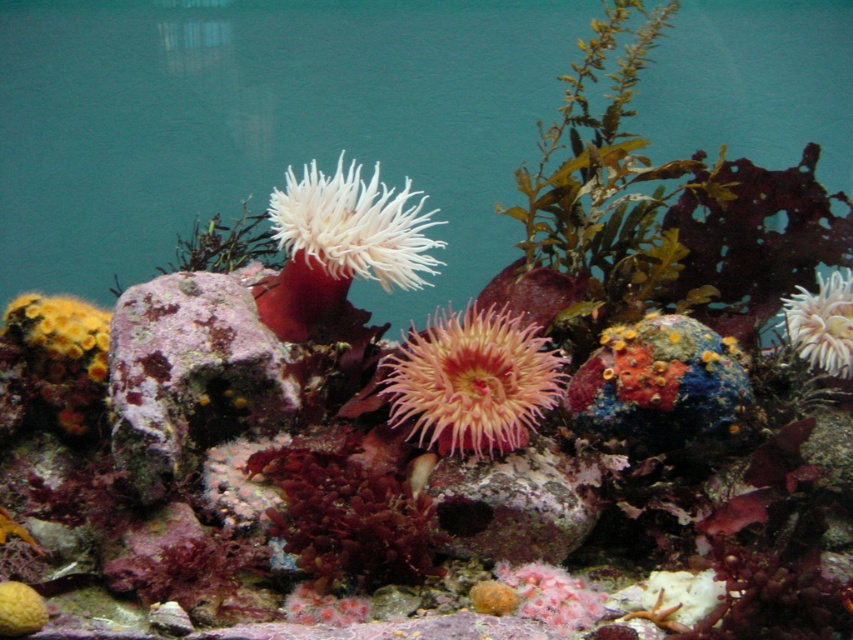
Does rusty coral rock at center have a smaller size compared to white fluffy anemone at upper right?

Incorrect, rusty coral rock at center is not smaller in size than white fluffy anemone at upper right.

Between rusty coral rock at center and white fluffy anemone at upper right, which one has more height?

rusty coral rock at center is taller.

The image size is (853, 640). What are the coordinates of `rusty coral rock at center` in the screenshot? It's located at (190, 376).

Identify the location of rusty coral rock at center. (190, 376).

Is point (578, 241) positioned behind point (279, 202)?

That is True.

Which is behind, point (548, 214) or point (346, 259)?

The point (548, 214) is behind.

Locate an element on the screen. green leafy plant at upper right is located at coordinates (606, 173).

What are the coordinates of `green leafy plant at upper right` in the screenshot? It's located at (606, 173).

How distant is pink soft coral at center from white fluffy anemone at upper right?

pink soft coral at center is 20.23 inches away from white fluffy anemone at upper right.

Between pink soft coral at center and white fluffy anemone at upper right, which one has more height?

pink soft coral at center

Which is behind, point (534, 392) or point (822, 300)?

Point (822, 300)

The height and width of the screenshot is (640, 853). In order to click on pink soft coral at center in this screenshot , I will do `click(473, 380)`.